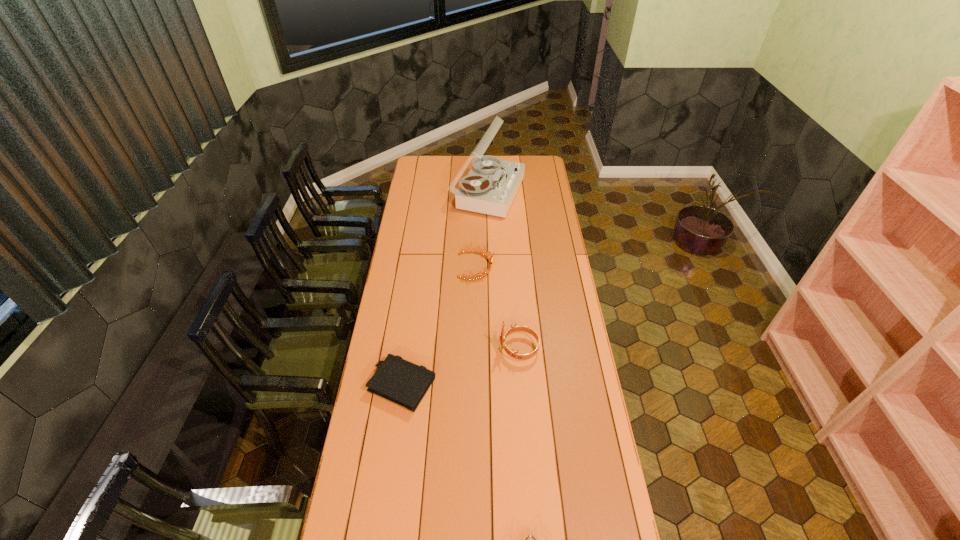
At what (x,y) coordinates should I click in order to perform the action: click on the second closest tiara to the fourth shortest object. Please return your answer as a coordinate pair (x, y). Looking at the image, I should click on (529, 535).

What are the coordinates of `free spot that satisfies the following two spatial constraints: 1. on the front-facing side of the second tallest object; 2. on the front side of the Bible` in the screenshot? It's located at (521, 385).